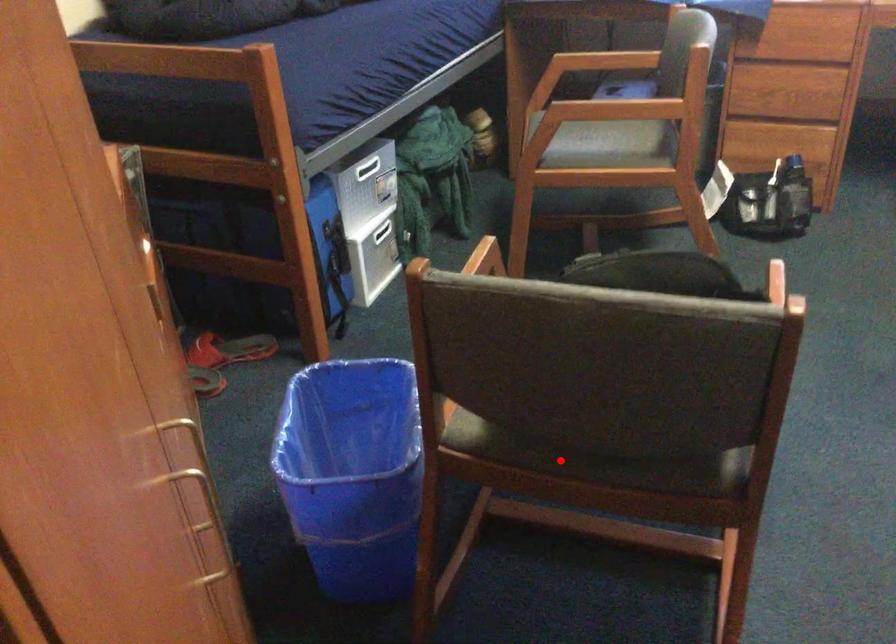
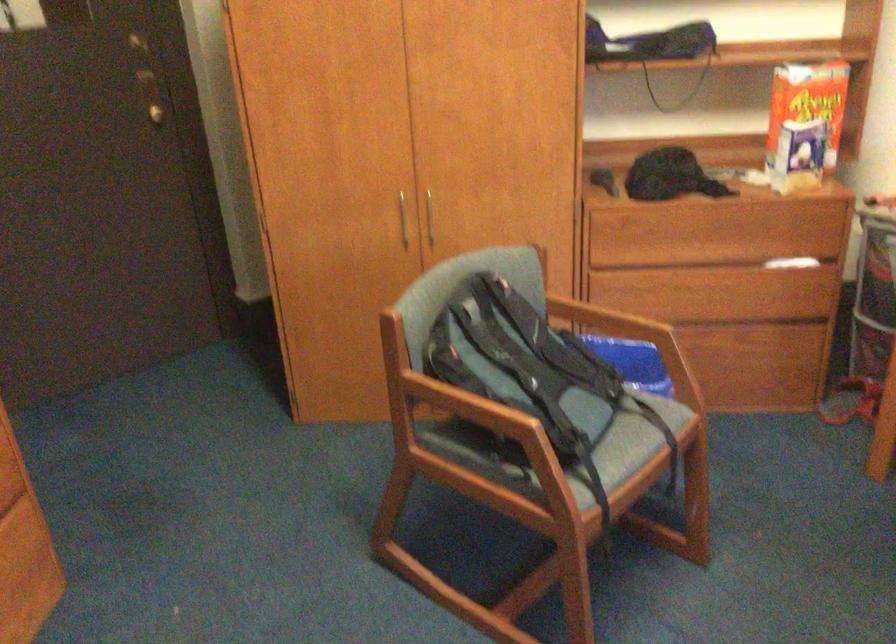
Question: I am providing you with two images of the same scene from different viewpoints. A red point is marked on the first image. Is the red point's position out of view in image 2?

Choices:
 (A) Yes
 (B) No

Answer: (A)